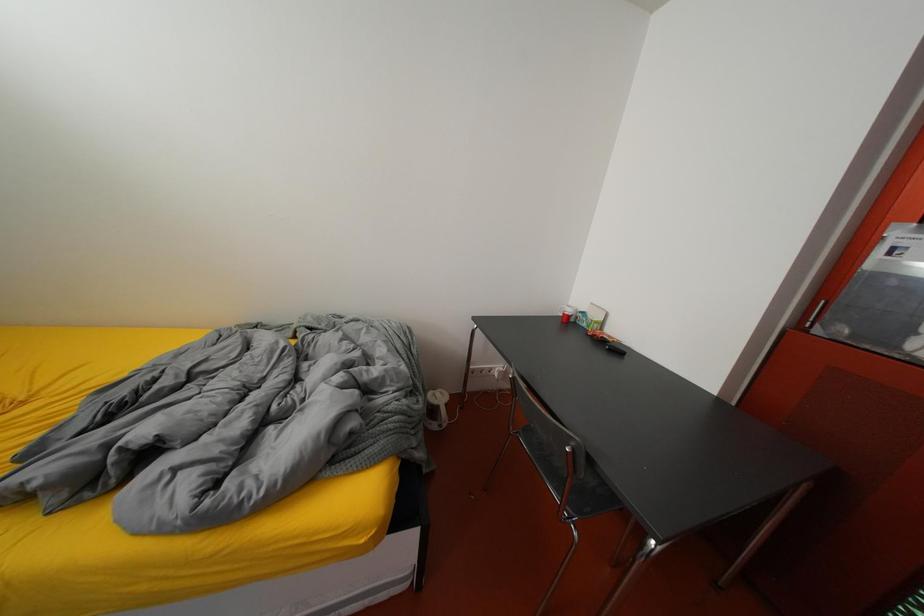
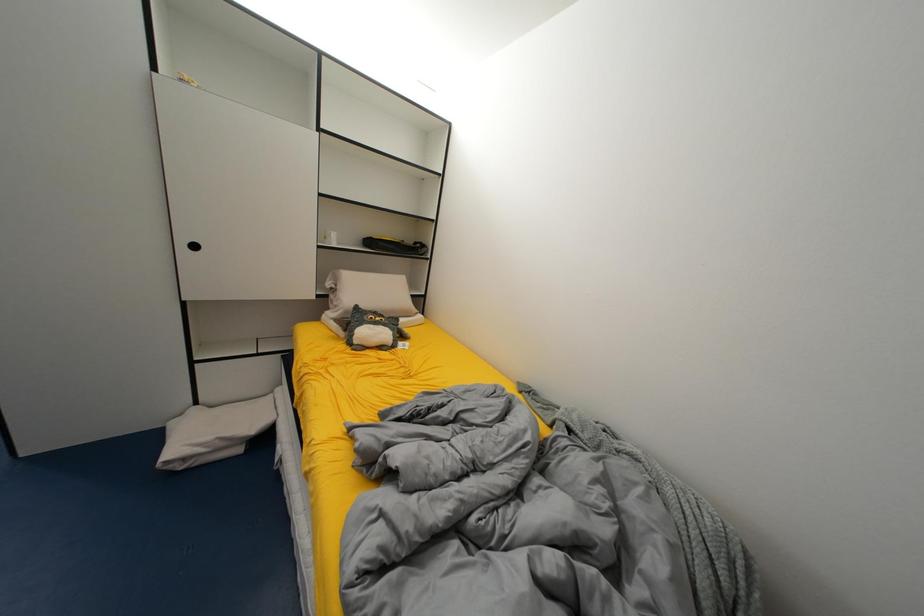
Question: The camera is either moving clockwise (left) or counter-clockwise (right) around the object. The first image is from the beginning of the video and the second image is from the end. Is the camera moving left or right when shooting the video?

Choices:
 (A) Left
 (B) Right

Answer: (B)